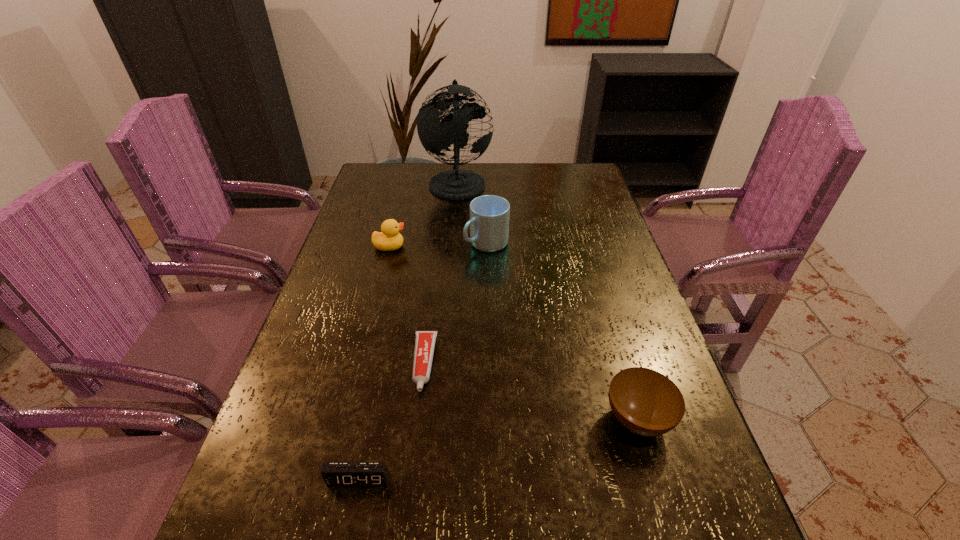
Identify the location of the farthest object. (435, 136).

Where is `the tallest object`? This screenshot has width=960, height=540. the tallest object is located at coordinates (435, 136).

Identify the location of the fifth shortest object. Image resolution: width=960 pixels, height=540 pixels. (489, 214).

This screenshot has height=540, width=960. Find the location of `duck`. duck is located at coordinates (389, 239).

Where is `the third shortest object`? This screenshot has height=540, width=960. the third shortest object is located at coordinates (647, 403).

Locate an element on the screen. The height and width of the screenshot is (540, 960). the rightmost object is located at coordinates pos(647,403).

You are a GUI agent. You are given a task and a screenshot of the screen. Output one action in this format:
    pyautogui.click(x=<x>, y=<y>)
    Task: Click on the second shortest object
    The height and width of the screenshot is (540, 960).
    Given the screenshot: What is the action you would take?
    pyautogui.click(x=335, y=474)

You are a GUI agent. You are given a task and a screenshot of the screen. Output one action in this format:
    pyautogui.click(x=<x>, y=<y>)
    Task: Click on the alarm clock
    The width and height of the screenshot is (960, 540).
    Given the screenshot: What is the action you would take?
    pyautogui.click(x=335, y=474)

Identify the location of the shortest object. (425, 340).

This screenshot has width=960, height=540. I want to click on free region located on the front-facing side of the globe, so click(585, 182).